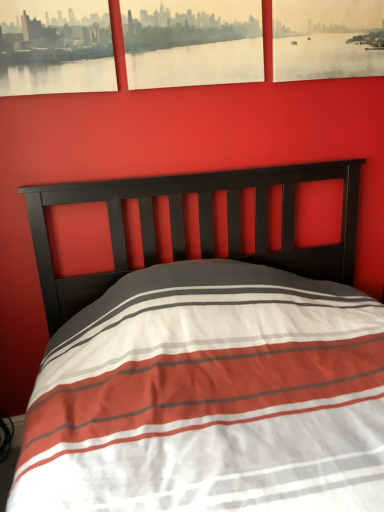
Question: Is matte paper picture frame at upper center, acting as the second picture frame starting from the right, to the left of matte black picture frame at upper left, the third picture frame in the right-to-left sequence, from the viewer's perspective?

Choices:
 (A) no
 (B) yes

Answer: (A)

Question: From a real-world perspective, does matte paper picture frame at upper center, acting as the second picture frame starting from the left, sit lower than matte black picture frame at upper left, arranged as the first picture frame when viewed from the left?

Choices:
 (A) no
 (B) yes

Answer: (B)

Question: Is the surface of matte paper picture frame at upper center, acting as the second picture frame starting from the left, in direct contact with matte black picture frame at upper left, the third picture frame in the right-to-left sequence?

Choices:
 (A) no
 (B) yes

Answer: (A)

Question: Is matte paper picture frame at upper center, acting as the second picture frame starting from the left, looking in the opposite direction of matte black picture frame at upper left, the third picture frame in the right-to-left sequence?

Choices:
 (A) yes
 (B) no

Answer: (B)

Question: Is matte paper picture frame at upper center, acting as the second picture frame starting from the left, shorter than matte black picture frame at upper left, the third picture frame in the right-to-left sequence?

Choices:
 (A) yes
 (B) no

Answer: (B)

Question: Is matte paper picture frame at upper center, acting as the second picture frame starting from the left, taller or shorter than matte black picture frame at upper left, arranged as the first picture frame when viewed from the left?

Choices:
 (A) tall
 (B) short

Answer: (A)

Question: From a real-world perspective, is matte paper picture frame at upper center, acting as the second picture frame starting from the left, above or below matte black picture frame at upper left, arranged as the first picture frame when viewed from the left?

Choices:
 (A) below
 (B) above

Answer: (A)

Question: Looking at their shapes, would you say matte paper picture frame at upper center, acting as the second picture frame starting from the right, is wider or thinner than matte black picture frame at upper left, the third picture frame in the right-to-left sequence?

Choices:
 (A) wide
 (B) thin

Answer: (A)

Question: Considering the positions of point (130, 86) and point (72, 16), is point (130, 86) closer or farther from the camera than point (72, 16)?

Choices:
 (A) farther
 (B) closer

Answer: (A)

Question: Based on their positions, is matte paper picture frame at upper center, acting as the second picture frame starting from the right, located to the left or right of matte paper picture frame at upper right, which is the 3th picture frame in left-to-right order?

Choices:
 (A) right
 (B) left

Answer: (B)

Question: Considering their positions, is matte paper picture frame at upper center, acting as the second picture frame starting from the left, located in front of or behind matte paper picture frame at upper right, which is the 3th picture frame in left-to-right order?

Choices:
 (A) behind
 (B) front

Answer: (B)

Question: Is matte paper picture frame at upper center, acting as the second picture frame starting from the right, situated inside matte paper picture frame at upper right, which ranks as the first picture frame in right-to-left order, or outside?

Choices:
 (A) outside
 (B) inside

Answer: (A)

Question: Is point (144, 31) closer or farther from the camera than point (357, 10)?

Choices:
 (A) closer
 (B) farther

Answer: (A)

Question: In terms of height, does matte black picture frame at upper left, arranged as the first picture frame when viewed from the left, look taller or shorter compared to matte paper picture frame at upper right, which ranks as the first picture frame in right-to-left order?

Choices:
 (A) tall
 (B) short

Answer: (B)

Question: Is matte black picture frame at upper left, the third picture frame in the right-to-left sequence, in front of or behind matte paper picture frame at upper right, which ranks as the first picture frame in right-to-left order, in the image?

Choices:
 (A) front
 (B) behind

Answer: (A)